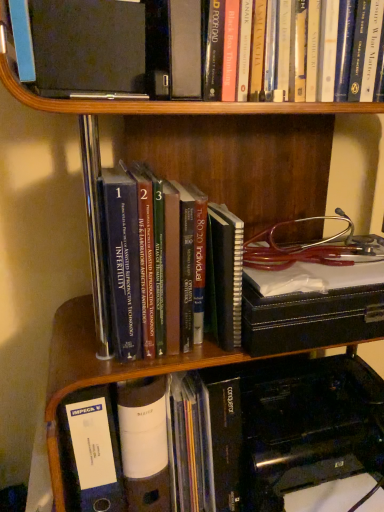
What is the approximate height of blue hardcover books at center, the second book when ordered from top to bottom?

The height of blue hardcover books at center, the second book when ordered from top to bottom, is 13.90 inches.

Find the location of a particular element. The width and height of the screenshot is (384, 512). blue hardcover books at center, the 2th book positioned from the bottom is located at coordinates (135, 263).

Where is `hardcover book at upper center, acting as the 1th book starting from the top`? This screenshot has height=512, width=384. hardcover book at upper center, acting as the 1th book starting from the top is located at coordinates click(x=374, y=17).

Can you confirm if hardcover book at upper center, acting as the 1th book starting from the top, is smaller than blue hardcover books at center, the second book when ordered from top to bottom?

No.

Is hardcover book at upper center, acting as the 1th book starting from the top, inside or outside of blue hardcover books at center, the second book when ordered from top to bottom?

hardcover book at upper center, acting as the 1th book starting from the top, lies outside blue hardcover books at center, the second book when ordered from top to bottom.

From a real-world perspective, is hardcover book at upper center, acting as the 1th book starting from the top, above or below blue hardcover books at center, the second book when ordered from top to bottom?

From a real-world perspective, hardcover book at upper center, acting as the 1th book starting from the top, is physically above blue hardcover books at center, the second book when ordered from top to bottom.

Considering the positions of objects hardcover book at upper center, acting as the 1th book starting from the top, and blue hardcover books at center, the second book when ordered from top to bottom, in the image provided, who is behind, hardcover book at upper center, acting as the 1th book starting from the top, or blue hardcover books at center, the second book when ordered from top to bottom,?

blue hardcover books at center, the second book when ordered from top to bottom, is behind.

Which is in front, blue hardcover books at center, the 2th book positioned from the bottom, or hardcover book at upper center, acting as the 1th book starting from the top?

hardcover book at upper center, acting as the 1th book starting from the top, is more forward.

Is blue hardcover books at center, the 2th book positioned from the bottom, touching hardcover book at upper center, acting as the 1th book starting from the top?

No, blue hardcover books at center, the 2th book positioned from the bottom, is not with hardcover book at upper center, acting as the 1th book starting from the top.

Can you confirm if blue hardcover books at center, the 2th book positioned from the bottom, is bigger than hardcover book at upper center, acting as the 1th book starting from the top?

No.

From a real-world perspective, is blue hardcover books at center, the 2th book positioned from the bottom, below hardcover book at upper center, acting as the 1th book starting from the top?

Correct, in the physical world, blue hardcover books at center, the 2th book positioned from the bottom, is lower than hardcover book at upper center, acting as the 1th book starting from the top.

Based on the photo, from a real-world perspective, is hardcover book at upper center, acting as the 1th book starting from the top, beneath orange matte book at center, which is counted as the first book, starting from the bottom?

Incorrect, from a real-world perspective, hardcover book at upper center, acting as the 1th book starting from the top, is higher than orange matte book at center, which is counted as the first book, starting from the bottom.

Can you tell me how much hardcover book at upper center, acting as the 1th book starting from the top, and orange matte book at center, which is counted as the first book, starting from the bottom, differ in facing direction?

0.111 degrees separate the facing orientations of hardcover book at upper center, acting as the 1th book starting from the top, and orange matte book at center, which is counted as the first book, starting from the bottom.

Is point (48, 96) closer to camera compared to point (315, 303)?

That is True.

From the image's perspective, is hardcover book at upper center, acting as the 1th book starting from the top, over orange matte book at center, which is counted as the first book, starting from the bottom?

Yes, from the image's perspective, hardcover book at upper center, acting as the 1th book starting from the top, is over orange matte book at center, which is counted as the first book, starting from the bottom.

The image size is (384, 512). I want to click on the 2nd book above the orange matte book at center, which is counted as the first book, starting from the bottom (from the image's perspective), so click(x=374, y=17).

Is orange matte book at center, which is counted as the first book, starting from the bottom, facing towards hardcover book at upper center, which is the 3th book in bottom-to-top order?

No, orange matte book at center, which is counted as the first book, starting from the bottom, is not facing towards hardcover book at upper center, which is the 3th book in bottom-to-top order.

Which object is closer to the camera taking this photo, orange matte book at center, which is the third book in top-to-bottom order, or hardcover book at upper center, which is the 3th book in bottom-to-top order?

hardcover book at upper center, which is the 3th book in bottom-to-top order, is more forward.

Would you say orange matte book at center, which is the third book in top-to-bottom order, is outside blue hardcover books at center, the 2th book positioned from the bottom?

Yes, orange matte book at center, which is the third book in top-to-bottom order, is not within blue hardcover books at center, the 2th book positioned from the bottom.

Is point (305, 309) farther from viewer compared to point (133, 167)?

No, (305, 309) is closer to viewer.

Between orange matte book at center, which is the third book in top-to-bottom order, and blue hardcover books at center, the second book when ordered from top to bottom, which one has larger width?

orange matte book at center, which is the third book in top-to-bottom order.

Between orange matte book at center, which is the third book in top-to-bottom order, and blue hardcover books at center, the 2th book positioned from the bottom, which one is positioned in front?

blue hardcover books at center, the 2th book positioned from the bottom, is closer to the camera.

From the image's perspective, relative to orange matte book at center, which is the third book in top-to-bottom order, is blue hardcover books at center, the 2th book positioned from the bottom, above or below?

Based on their image positions, blue hardcover books at center, the 2th book positioned from the bottom, is located above orange matte book at center, which is the third book in top-to-bottom order.

Considering their positions, is blue hardcover books at center, the second book when ordered from top to bottom, located in front of or behind orange matte book at center, which is counted as the first book, starting from the bottom?

Visually, blue hardcover books at center, the second book when ordered from top to bottom, is located in front of orange matte book at center, which is counted as the first book, starting from the bottom.

Is blue hardcover books at center, the second book when ordered from top to bottom, to the right of orange matte book at center, which is the third book in top-to-bottom order, from the viewer's perspective?

Incorrect, blue hardcover books at center, the second book when ordered from top to bottom, is not on the right side of orange matte book at center, which is the third book in top-to-bottom order.

Could you measure the distance between blue hardcover books at center, the second book when ordered from top to bottom, and orange matte book at center, which is counted as the first book, starting from the bottom?

blue hardcover books at center, the second book when ordered from top to bottom, and orange matte book at center, which is counted as the first book, starting from the bottom, are 8.59 inches apart.

The width and height of the screenshot is (384, 512). In order to click on book on the left of hardcover book at upper center, which is the 3th book in bottom-to-top order in this screenshot , I will do `click(135, 263)`.

What are the coordinates of `book lying in front of the blue hardcover books at center, the 2th book positioned from the bottom` in the screenshot? It's located at (374, 17).

From the image, which object appears to be nearer to orange matte book at center, which is the third book in top-to-bottom order, hardcover book at upper center, acting as the 1th book starting from the top, or blue hardcover books at center, the 2th book positioned from the bottom?

blue hardcover books at center, the 2th book positioned from the bottom, lies closer to orange matte book at center, which is the third book in top-to-bottom order, than the other object.

From the image, which object appears to be farther from hardcover book at upper center, which is the 3th book in bottom-to-top order, blue hardcover books at center, the 2th book positioned from the bottom, or orange matte book at center, which is counted as the first book, starting from the bottom?

blue hardcover books at center, the 2th book positioned from the bottom, is further to hardcover book at upper center, which is the 3th book in bottom-to-top order.

In the scene shown: From the image, which object appears to be farther from blue hardcover books at center, the 2th book positioned from the bottom, hardcover book at upper center, which is the 3th book in bottom-to-top order, or orange matte book at center, which is the third book in top-to-bottom order?

Among the two, hardcover book at upper center, which is the 3th book in bottom-to-top order, is located further to blue hardcover books at center, the 2th book positioned from the bottom.

Which object lies further to the anchor point orange matte book at center, which is counted as the first book, starting from the bottom, blue hardcover books at center, the 2th book positioned from the bottom, or hardcover book at upper center, which is the 3th book in bottom-to-top order?

hardcover book at upper center, which is the 3th book in bottom-to-top order, lies further to orange matte book at center, which is counted as the first book, starting from the bottom, than the other object.

In the scene shown: Based on their spatial positions, is orange matte book at center, which is counted as the first book, starting from the bottom, or blue hardcover books at center, the 2th book positioned from the bottom, further from hardcover book at upper center, which is the 3th book in bottom-to-top order?

The object further to hardcover book at upper center, which is the 3th book in bottom-to-top order, is blue hardcover books at center, the 2th book positioned from the bottom.

Considering their positions, is orange matte book at center, which is the third book in top-to-bottom order, positioned further to blue hardcover books at center, the 2th book positioned from the bottom, than hardcover book at upper center, which is the 3th book in bottom-to-top order?

Among the two, hardcover book at upper center, which is the 3th book in bottom-to-top order, is located further to blue hardcover books at center, the 2th book positioned from the bottom.

Identify the location of book between hardcover book at upper center, which is the 3th book in bottom-to-top order, and orange matte book at center, which is the third book in top-to-bottom order, in the vertical direction. (135, 263).